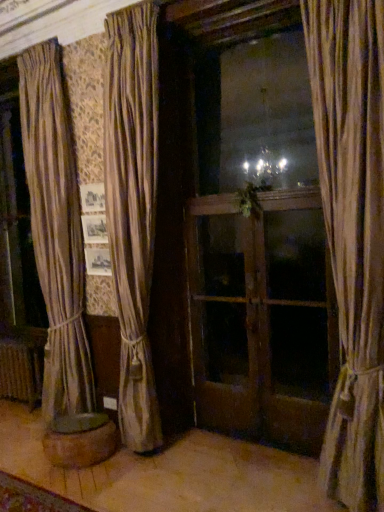
Question: From the image's perspective, is wooden screen door at center, positioned as the first screen door in right-to-left order, above or below green leafy plant at center?

Choices:
 (A) above
 (B) below

Answer: (B)

Question: Visually, is wooden screen door at center, which is the 2th screen door in left-to-right order, positioned to the left or to the right of green leafy plant at center?

Choices:
 (A) right
 (B) left

Answer: (A)

Question: Considering the real-world distances, which object is closest to the wooden screen door at center, marked as the 2th screen door in a right-to-left arrangement?

Choices:
 (A) beige fabric curtain at right, marked as the 1th curtain in a front-to-back arrangement
 (B) brown wood stool at lower left
 (C) silky beige curtain at center, arranged as the 2th curtain when viewed from the front
 (D) wooden screen door at center, which is the 2th screen door in left-to-right order
 (E) rustic metal radiator at lower left

Answer: (D)

Question: Which object is positioned farthest from the wooden screen door at center, marked as the 2th screen door in a right-to-left arrangement?

Choices:
 (A) brown wood stool at lower left
 (B) silky beige curtain at center, which ranks as the 1th curtain in back-to-front order
 (C) beige fabric curtain at right, which is the 2th curtain from back to front
 (D) green leafy plant at center
 (E) rustic metal radiator at lower left

Answer: (E)